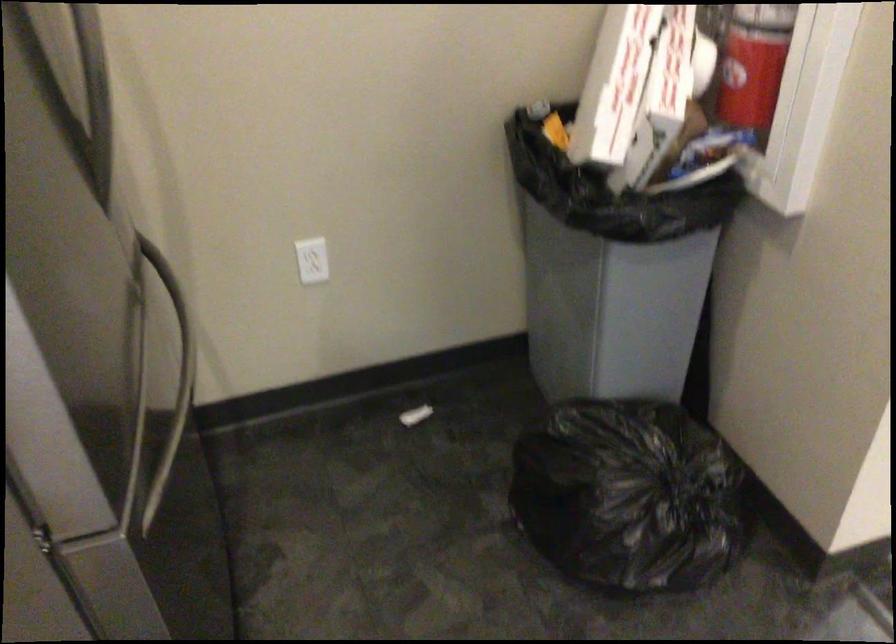
Where is `red cylindrical container`? This screenshot has width=896, height=644. red cylindrical container is located at coordinates (754, 64).